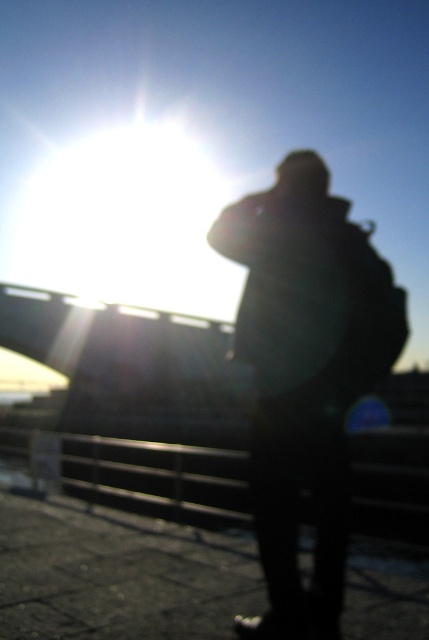
You are a photographer trying to capture the silhouette of the person in the image. The camera you are using has a focus point at coordinate point 0.588, 0.713. Will the focus point align with the black matte jacket at center?

The position of black matte jacket at center is at point (x=305, y=376), so yes, the focus point will align with the black matte jacket at center.

You are a photographer trying to capture the scene. You want to ensure that the black matte jacket at center and the metallic bridge at center are both clearly visible in your shot. Given their relative sizes, which object might require you to adjust your focus more carefully to ensure clarity?

The black matte jacket at center is thinner than the metallic bridge at center, so the jacket might require more careful focus adjustment due to its smaller size.

You are standing at the point where the person is located in the image. The metallic bridge at center is located at point (138, 397). If you want to walk towards the metallic bridge at center, which direction should you move relative to your current position?

The metallic bridge at center is located at point (138, 397), so you should move towards that coordinate to reach it.